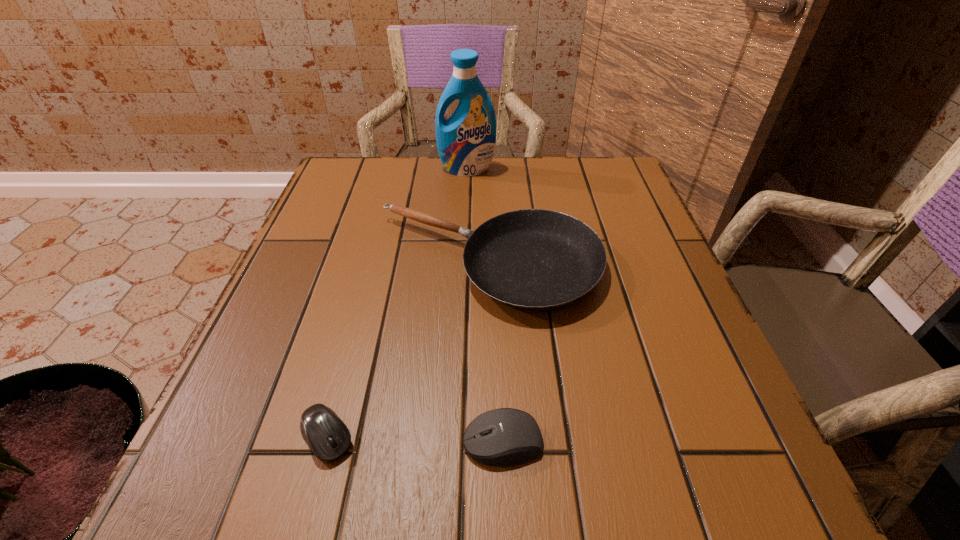
You are a GUI agent. You are given a task and a screenshot of the screen. Output one action in this format:
    pyautogui.click(x=<x>, y=<y>)
    Task: Click on the second closest object relative to the detergent
    This screenshot has height=540, width=960.
    Given the screenshot: What is the action you would take?
    click(x=326, y=434)

Where is `vacant space that satisfies the following two spatial constraints: 1. on the front-facing side of the right computer equipment; 2. on the left side of the farthest object`? The height and width of the screenshot is (540, 960). vacant space that satisfies the following two spatial constraints: 1. on the front-facing side of the right computer equipment; 2. on the left side of the farthest object is located at coordinates (455, 442).

Where is `free space that satisfies the following two spatial constraints: 1. on the front-facing side of the right computer equipment; 2. on the left side of the tallest object`? This screenshot has height=540, width=960. free space that satisfies the following two spatial constraints: 1. on the front-facing side of the right computer equipment; 2. on the left side of the tallest object is located at coordinates (455, 442).

Find the location of a particular element. The width and height of the screenshot is (960, 540). free space in the image that satisfies the following two spatial constraints: 1. on the front-facing side of the right computer equipment; 2. on the right side of the tallest object is located at coordinates (455, 442).

Where is `vacant position in the image that satisfies the following two spatial constraints: 1. on the front-facing side of the second tallest object; 2. on the left side of the tallest object`? The height and width of the screenshot is (540, 960). vacant position in the image that satisfies the following two spatial constraints: 1. on the front-facing side of the second tallest object; 2. on the left side of the tallest object is located at coordinates (463, 264).

Identify the location of free space that satisfies the following two spatial constraints: 1. on the front-facing side of the tallest object; 2. on the right side of the frying pan. The image size is (960, 540). (463, 264).